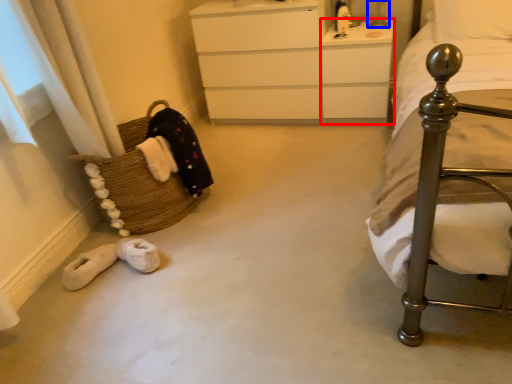
Question: Which object appears closest to the camera in this image, vanity (highlighted by a red box) or table lamp (highlighted by a blue box)?

Choices:
 (A) vanity
 (B) table lamp

Answer: (A)